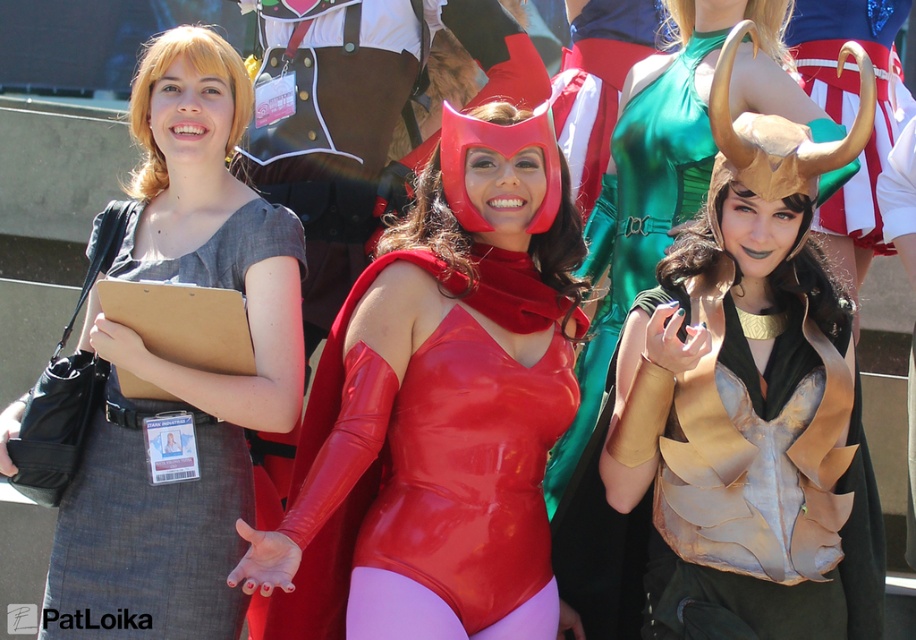
Is gold metallic armor at center thinner than matte gray dress at center?

Correct, gold metallic armor at center's width is less than matte gray dress at center's.

This screenshot has height=640, width=916. What are the coordinates of `gold metallic armor at center` in the screenshot? It's located at (744, 394).

The width and height of the screenshot is (916, 640). Find the location of `gold metallic armor at center`. gold metallic armor at center is located at coordinates (744, 394).

Is rubberized red bodysuit at center taller than matte gray dress at center?

Incorrect, rubberized red bodysuit at center's height is not larger of matte gray dress at center's.

Is point (341, 467) positioned in front of point (264, 348)?

Yes, it is in front of point (264, 348).

Find the location of a particular element. The image size is (916, 640). rubberized red bodysuit at center is located at coordinates pos(439,404).

Can you confirm if gold metallic armor at center is positioned below rubberized red bodysuit at center?

Actually, gold metallic armor at center is above rubberized red bodysuit at center.

Is point (821, 424) closer to viewer compared to point (516, 332)?

That is True.

Where is `gold metallic armor at center`? gold metallic armor at center is located at coordinates (744, 394).